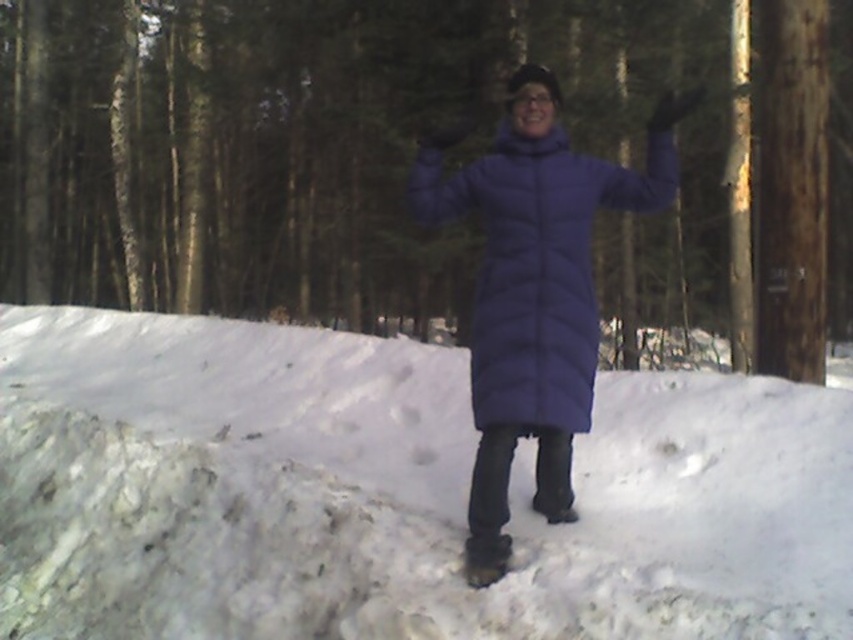
You are standing in a snowy forest and want to walk from the point at coordinates (47, 369) to the point at (625, 193). Which direction should you face to move towards the second point?

To move from point (47, 369) to point (625, 193), you should face towards the upper left direction since the second point is located above and to the left of the first point.

You are a delivery robot with a 3.5 feet wide package. You need to move from the forest path to the person wearing the matte blue puffer jacket at center. The white fluffy snow at center is in your path. Can you navigate around the snow without disturbing it?

The white fluffy snow at center is 9.38 feet away from the matte blue puffer jacket at center. Since the distance between them is greater than the package width of 3.5 feet, the robot can navigate around the snow while maintaining a safe distance to avoid disturbance.